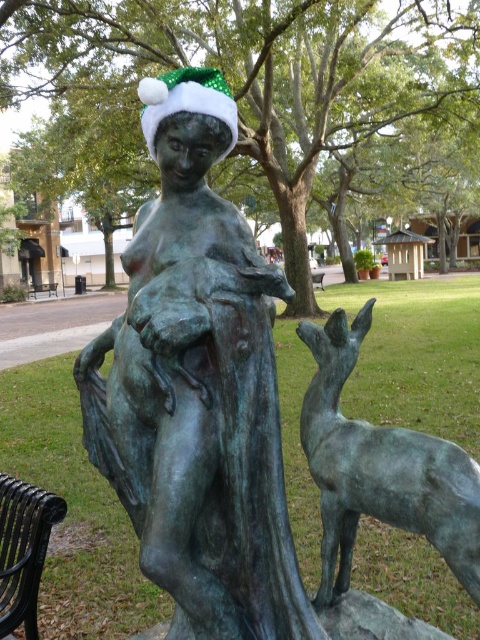
Describe the element at coordinates (197, 388) in the screenshot. This screenshot has height=640, width=480. I see `bronze statue at center` at that location.

Measure the distance from bronze statue at center to black metal park bench at center.

bronze statue at center and black metal park bench at center are 26.64 meters apart.

Does point (228, 484) come in front of point (313, 273)?

Yes, point (228, 484) is in front of point (313, 273).

Image resolution: width=480 pixels, height=640 pixels. Find the location of `bronze statue at center`. bronze statue at center is located at coordinates (197, 388).

Can you confirm if green patina deer at center is positioned below black wrought iron bench at lower left?

Actually, green patina deer at center is above black wrought iron bench at lower left.

The image size is (480, 640). What do you see at coordinates (381, 468) in the screenshot?
I see `green patina deer at center` at bounding box center [381, 468].

I want to click on green patina deer at center, so click(x=381, y=468).

Describe the element at coordinates (24, 548) in the screenshot. I see `black wrought iron bench at lower left` at that location.

Can you confirm if black wrought iron bench at lower left is wider than black metal park bench at center?

No.

This screenshot has width=480, height=640. Describe the element at coordinates (24, 548) in the screenshot. I see `black wrought iron bench at lower left` at that location.

At what (x,y) coordinates should I click in order to perform the action: click on black wrought iron bench at lower left. Please return your answer as a coordinate pair (x, y). Looking at the image, I should click on (24, 548).